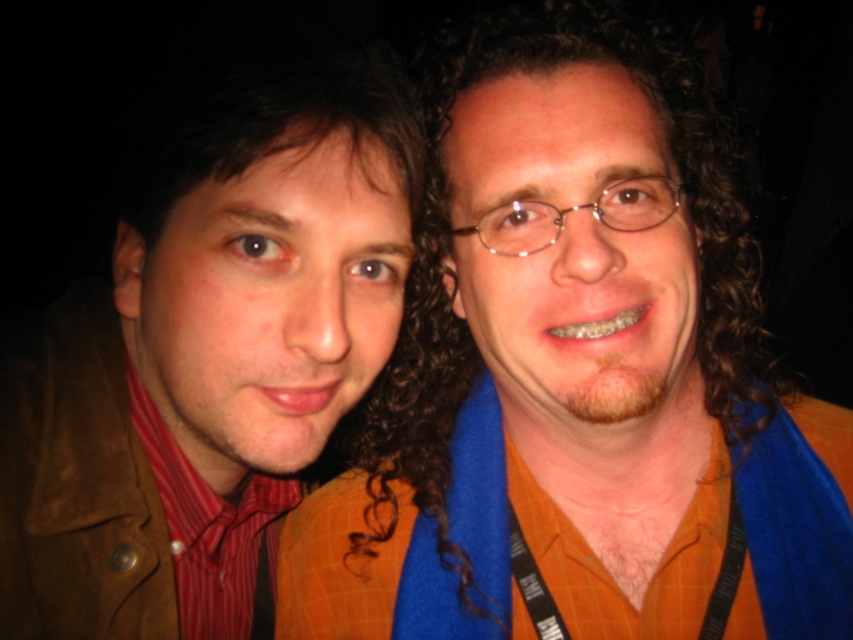
Based on the photo, you are a photographer trying to adjust the lighting for a portrait. You notice the orange checkered shirt at center and the matte brown jacket at left. Which clothing item is positioned higher in the frame?

The orange checkered shirt at center is above the matte brown jacket at left, so it is positioned higher in the frame.

You are a photographer trying to adjust the lighting for a photo shoot. You notice the orange checkered shirt at center and the red striped shirt at left. Which shirt is positioned more to the right side of the image?

The orange checkered shirt at center is positioned more to the right side of the image compared to the red striped shirt at left.